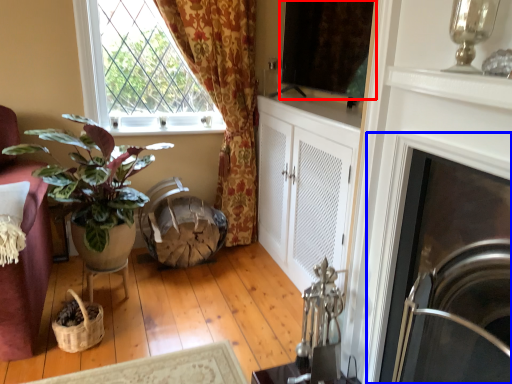
Question: Which of the following is the farthest to the observer, window screen (highlighted by a red box) or fireplace (highlighted by a blue box)?

Choices:
 (A) window screen
 (B) fireplace

Answer: (A)